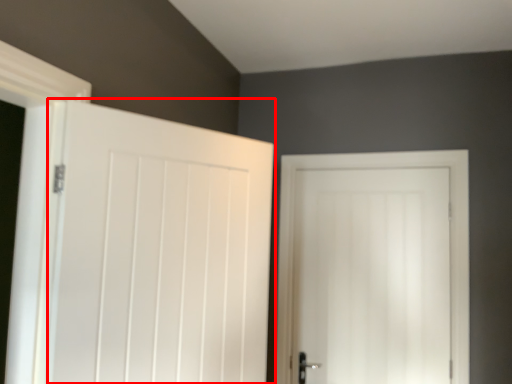
Question: From the image's perspective, where is door (annotated by the red box) located in relation to door in the image?

Choices:
 (A) above
 (B) below

Answer: (A)